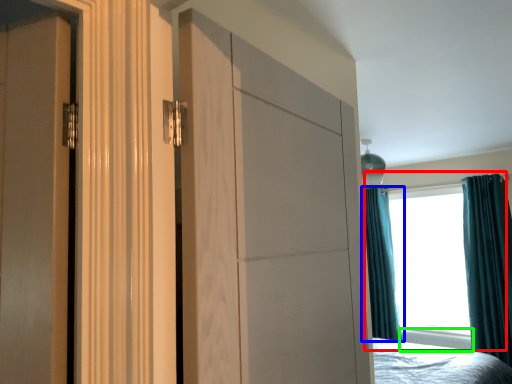
Question: Which object is positioned farthest from window (highlighted by a red box)? Select from curtain (highlighted by a blue box) and radiator (highlighted by a green box).

Choices:
 (A) curtain
 (B) radiator

Answer: (B)